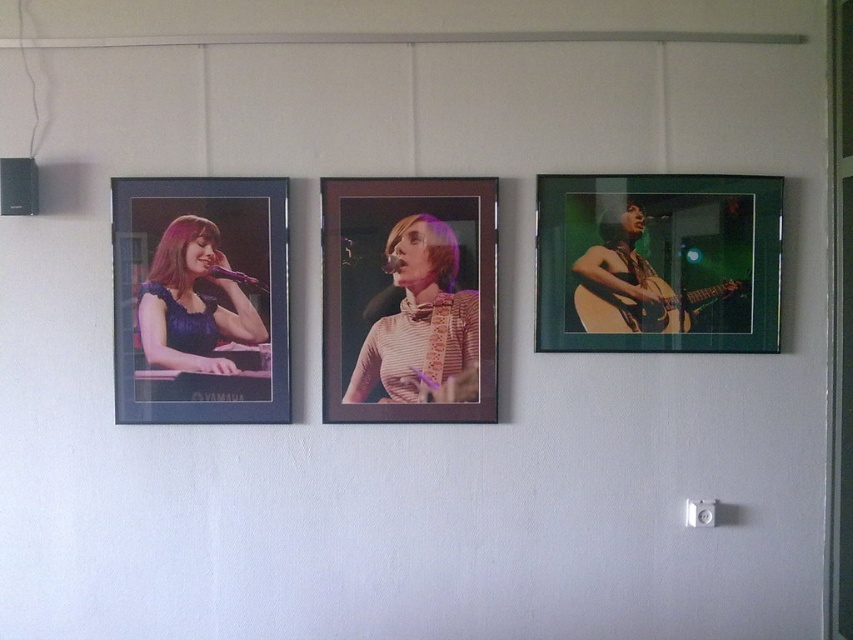
Question: Among these objects, which one is farthest from the camera?

Choices:
 (A) matte black frame at left
 (B) matte black frame at center
 (C) matte purple dress at left

Answer: (B)

Question: Estimate the real-world distances between objects in this image. Which object is farther from the matte black frame at left?

Choices:
 (A) acoustic wood guitar at right
 (B) matte black frame at center
 (C) green matte picture frame at right
 (D) matte purple dress at left

Answer: (A)

Question: Considering the real-world distances, which object is farthest from the acoustic wood guitar at right?

Choices:
 (A) matte black frame at center
 (B) green matte picture frame at right
 (C) matte black frame at left
 (D) matte purple dress at left

Answer: (D)

Question: Can you confirm if matte black frame at left is positioned above matte black frame at center?

Choices:
 (A) no
 (B) yes

Answer: (A)

Question: Can you confirm if green matte picture frame at right is positioned below matte purple dress at left?

Choices:
 (A) no
 (B) yes

Answer: (A)

Question: In this image, where is matte black frame at left located relative to acoustic wood guitar at right?

Choices:
 (A) above
 (B) below

Answer: (A)